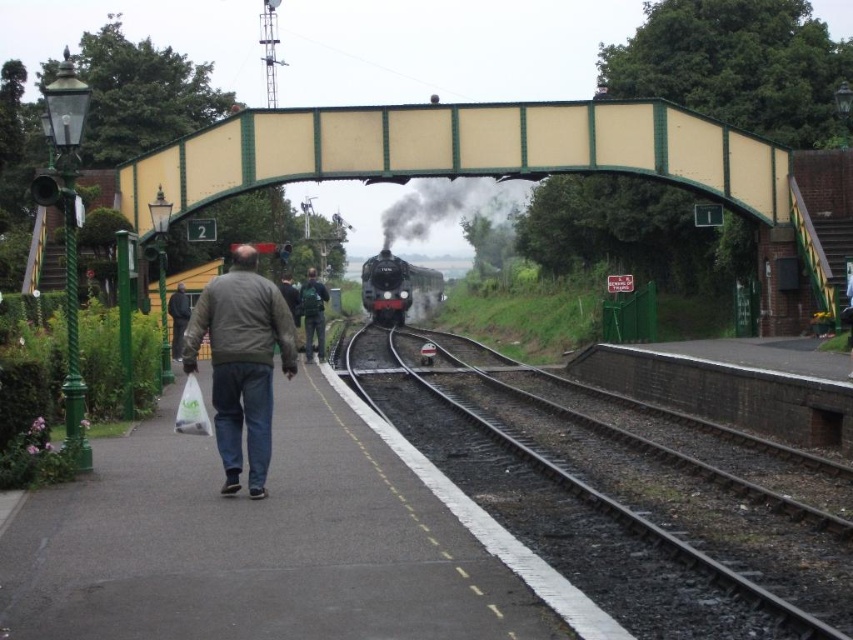
You are standing on the platform at the railway station and want to move from one point to another. If you start at point (369, 132) and walk towards point (428, 305), will you be moving away from or towards the steam locomotive that is approaching on the tracks?

The point (369, 132) is closer to the viewer than point (428, 305). Since the steam locomotive is approaching on the tracks leading into the distance, moving from the closer point to the farther point means you are moving away from the approaching train.

You are a passenger waiting at the station and see the black metal train track at lower center and the dark gray jacket at center. Which object appears larger in the image?

The dark gray jacket at center appears larger than the black metal train track at lower center in the image.

You are standing at point (x=625, y=500) and want to reach the safety line painted along the platform edge as quickly as possible. Which direction should you move?

The black metal train track at lower center is located at point (x=625, y=500). Since the safety line is along the platform edge, you should move towards the direction away from the tracks and towards the edge of the platform.